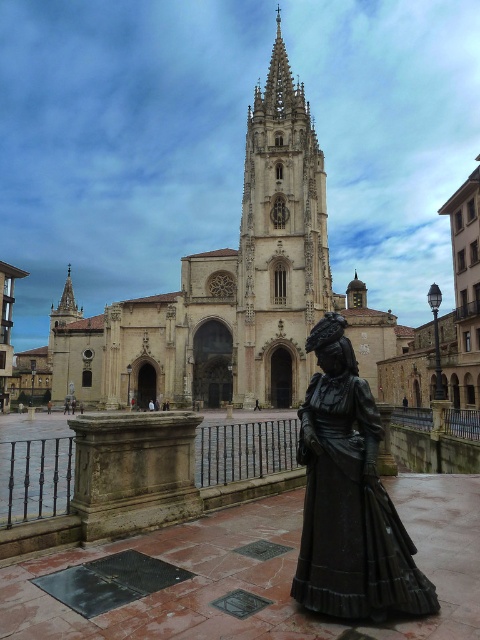
You are standing at the base of the cathedral and notice a point marked at coordinates (279,243). What object is located at this point?

The point at (279,243) is occupied by the smooth stone tower at center.